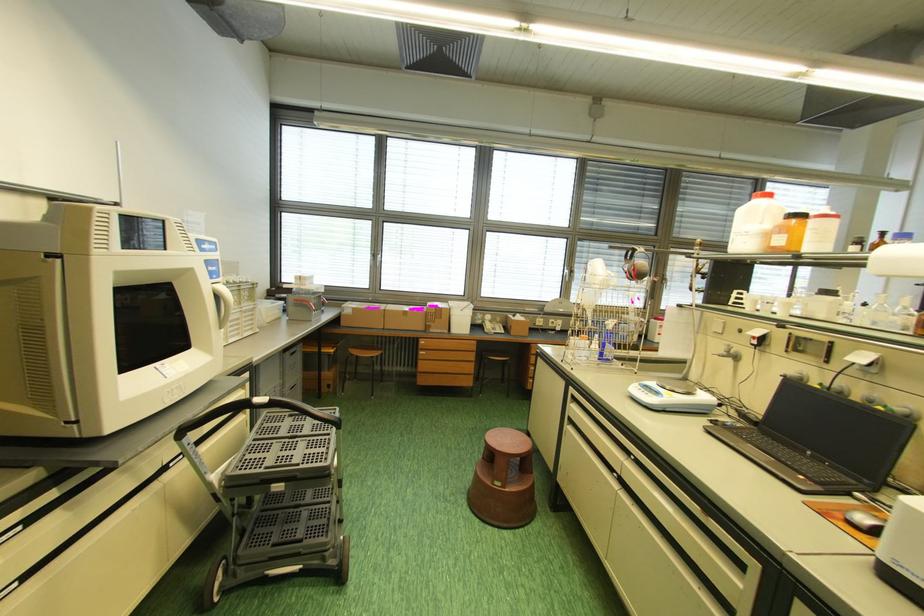
Find the location of a particular element. This screenshot has height=616, width=924. white container red lid is located at coordinates (762, 193).